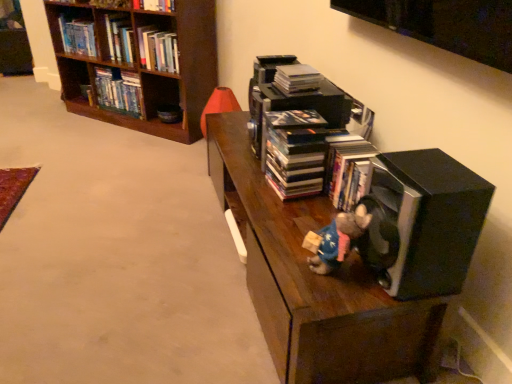
The image size is (512, 384). I want to click on free space to the left of dark wood shelf at center, so click(118, 246).